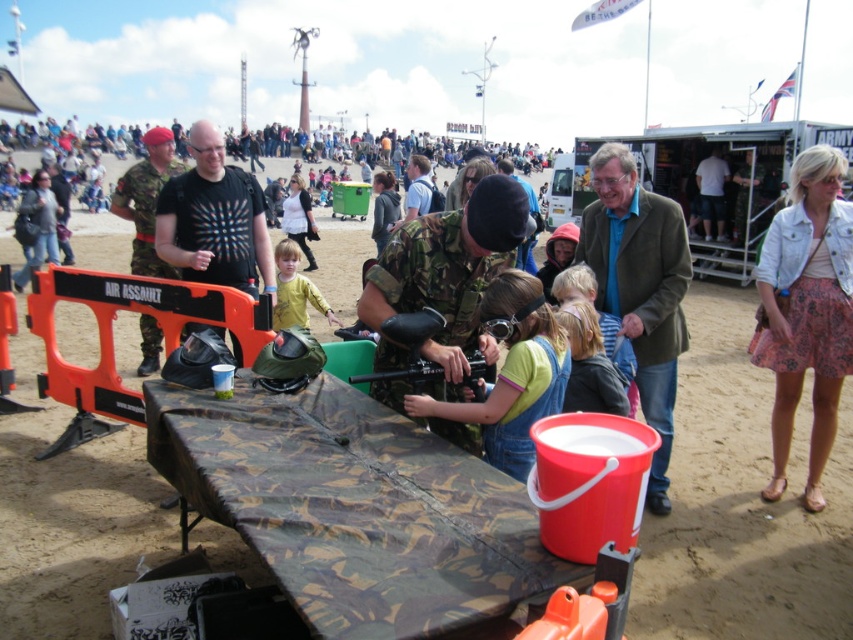
Consider the image. You are a photographer at the event and want to capture a clear photo of both the yellow matte shirt at center and the dark blue jeans at center. Since the camera can only focus on one object at a time, which one should you focus on to ensure the other is still somewhat in focus?

The yellow matte shirt at center is closer to the viewer than dark blue jeans at center. To ensure both are somewhat in focus, focus on the yellow matte shirt at center because it is closer, and the dark blue jeans at center will be slightly out of focus but still recognizable.

You are a photographer at the event and want to set up your tripod to capture the camouflage fabric table at center. What are the coordinates where you should place the tripod?

The camouflage fabric table at center is located at coordinates point (355,508), so you should place the tripod there to capture it.

You are planning to set up a booth at the event and need to know the space required. Given that the camouflage uniform at center is 1.2 meters wide, can the camouflage fabric table at center fit within a 1.0 meter wide space?

The camouflage fabric table at center has a lesser width compared to the camouflage uniform at center, which is 1.2 meters wide. Therefore, the table is narrower than 1.2 meters. Since the required space is 1.0 meters, it depends on the exact width of the table. However, based on the description, the table is narrower than 1.2 meters but we don not have its exact width. Thus, it might or might not fit. Please check the table dimensions.